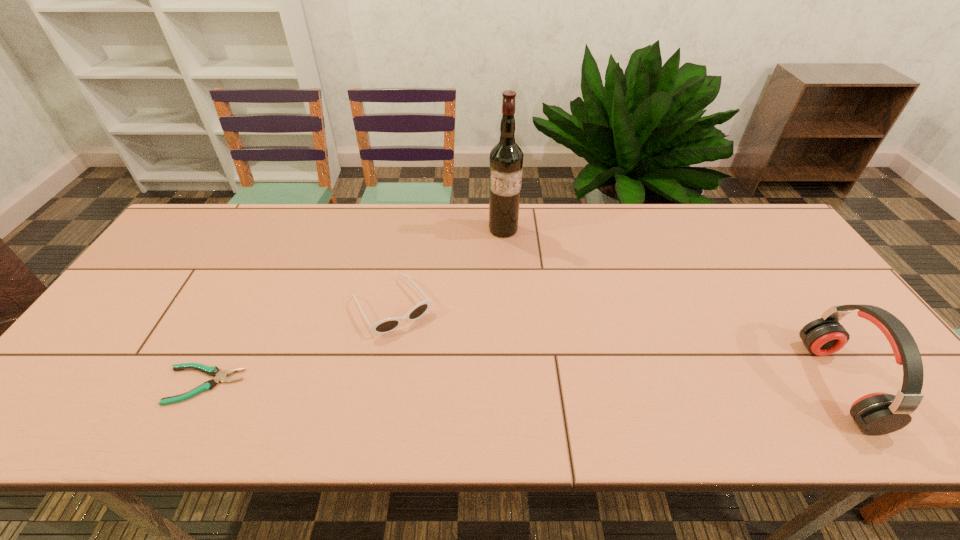
Locate an element on the screen. vacant area located on the ear cups of the rightmost object is located at coordinates (670, 384).

What are the coordinates of `free space located on the ear cups of the rightmost object` in the screenshot? It's located at (728, 384).

Image resolution: width=960 pixels, height=540 pixels. In order to click on vacant area situated with the lenses of the second shortest object facing outward in this screenshot , I will do `click(437, 370)`.

Image resolution: width=960 pixels, height=540 pixels. What are the coordinates of `vacant space located 0.130m with the lenses of the second shortest object facing outward` in the screenshot? It's located at click(x=437, y=370).

Locate an element on the screen. free spot located 0.120m with the lenses of the second shortest object facing outward is located at coordinates (434, 367).

You are a GUI agent. You are given a task and a screenshot of the screen. Output one action in this format:
    pyautogui.click(x=<x>, y=<y>)
    Task: Click on the free spot located 0.220m on the front and back of the third object from left to right
    
    Given the screenshot: What is the action you would take?
    pyautogui.click(x=505, y=289)

Find the location of `vacant space situated on the front and back of the third object from left to right`. vacant space situated on the front and back of the third object from left to right is located at coordinates (505, 292).

Find the location of `free space located on the front and back of the third object from left to right`. free space located on the front and back of the third object from left to right is located at coordinates (505, 267).

At what (x,y) coordinates should I click in order to perform the action: click on object located in the far edge section of the desktop. Please return your answer as a coordinate pair (x, y). Looking at the image, I should click on (506, 158).

Identify the location of pliers located in the near edge section of the desktop. (220, 376).